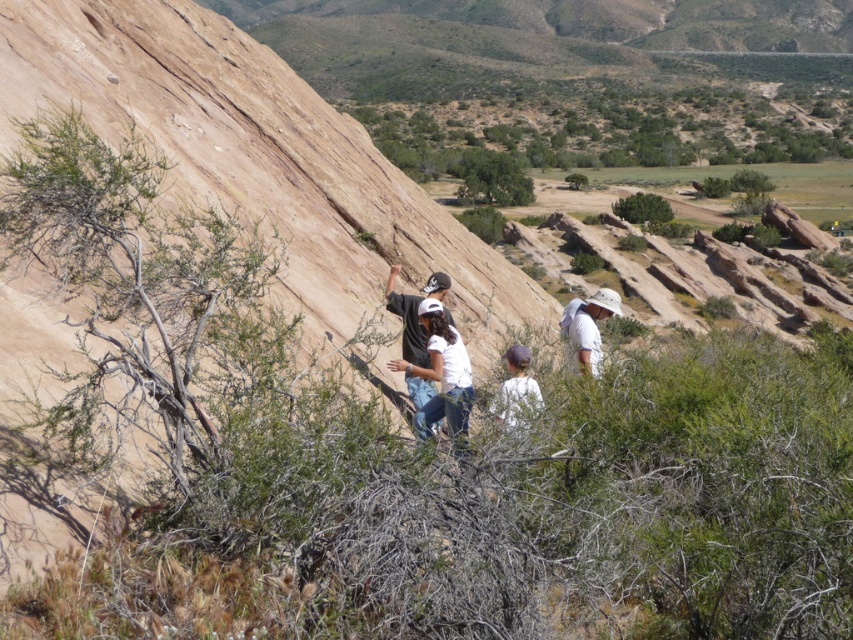
Is white fabric hat at center smaller than white fabric at center?

Incorrect, white fabric hat at center is not smaller in size than white fabric at center.

Is white fabric hat at center thinner than white fabric at center?

No, white fabric hat at center is not thinner than white fabric at center.

Where is `white fabric hat at center`? This screenshot has height=640, width=853. white fabric hat at center is located at coordinates (589, 326).

Can you confirm if white matte shirt at center is thinner than white fabric at center?

Incorrect, white matte shirt at center's width is not less than white fabric at center's.

Is white matte shirt at center above white fabric at center?

No.

Is point (451, 436) positioned behind point (515, 365)?

No, (451, 436) is closer to viewer.

Find the location of a particular element. The height and width of the screenshot is (640, 853). white matte shirt at center is located at coordinates (442, 378).

Between white matte shirt at center and white fabric hat at center, which one appears on the left side from the viewer's perspective?

white matte shirt at center

Does white matte shirt at center have a greater height compared to white fabric hat at center?

Yes.

Between point (431, 424) and point (583, 365), which one is positioned in front?

Positioned in front is point (431, 424).

Find the location of `white matte shirt at center`. white matte shirt at center is located at coordinates (442, 378).